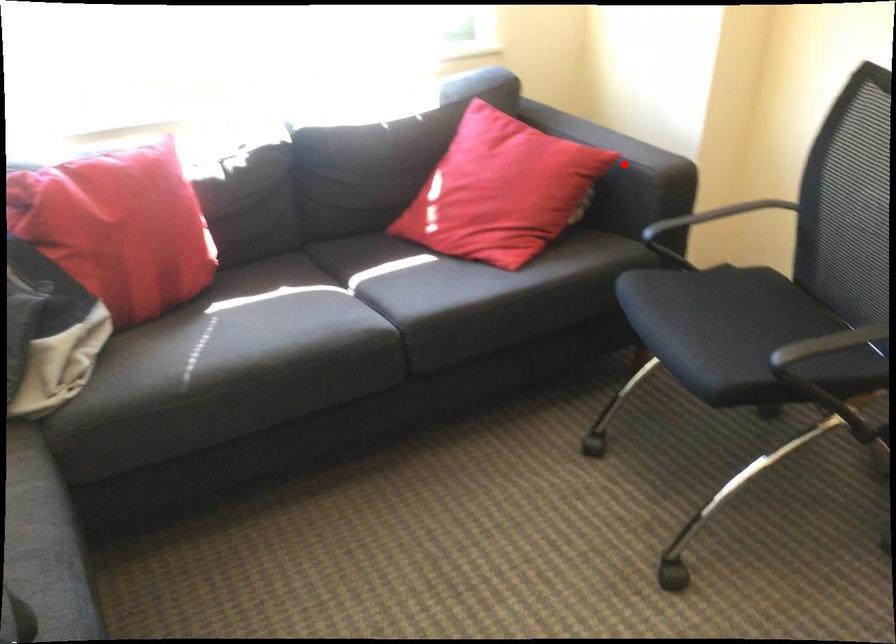
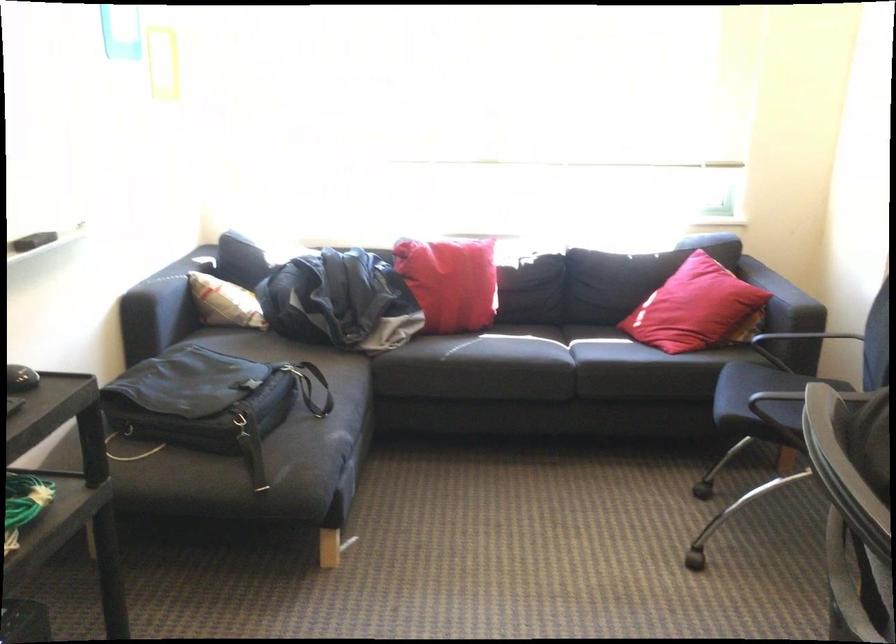
Question: I am providing you with two images of the same scene from different viewpoints. A red point is shown in image1. For the corresponding object point in image2, is it positioned nearer or farther from the camera?

Choices:
 (A) Nearer
 (B) Farther

Answer: (B)